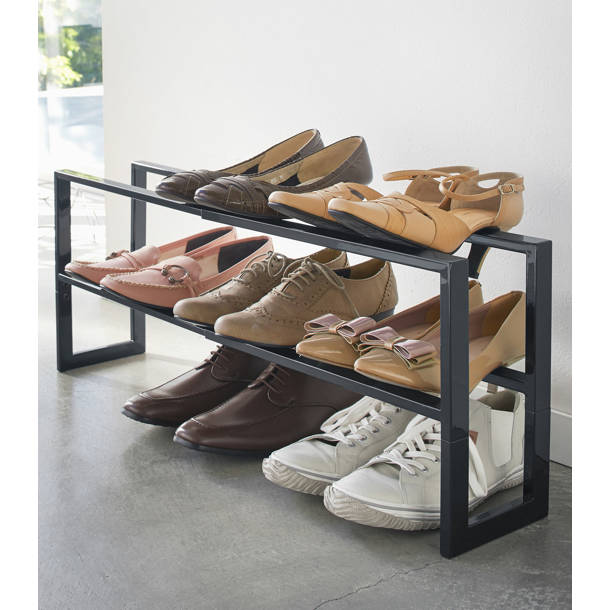
Image resolution: width=610 pixels, height=610 pixels. In order to click on shoes on bottom of rack in this screenshot , I will do (x=194, y=398), (x=237, y=423), (x=318, y=467), (x=378, y=498).